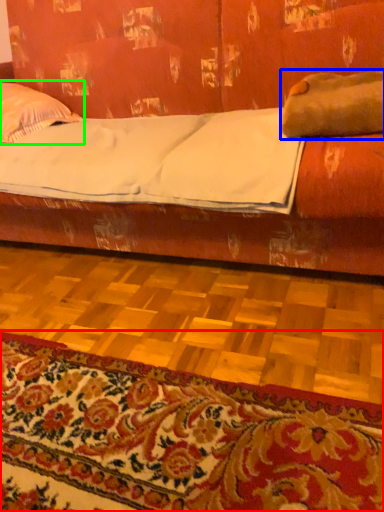
Question: Estimate the real-world distances between objects in this image. Which object is closer to mat (highlighted by a red box), pillow (highlighted by a blue box) or pillow (highlighted by a green box)?

Choices:
 (A) pillow
 (B) pillow

Answer: (A)